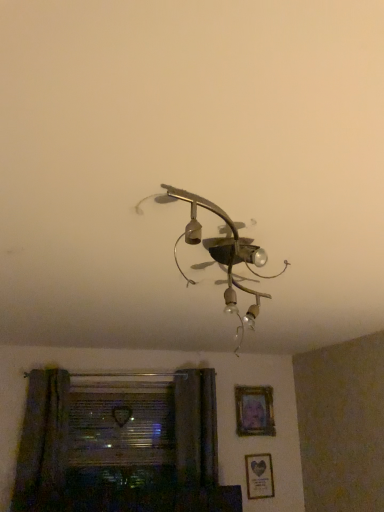
What do you see at coordinates (219, 252) in the screenshot? This screenshot has width=384, height=512. I see `metallic chandelier at center` at bounding box center [219, 252].

This screenshot has height=512, width=384. What do you see at coordinates (254, 411) in the screenshot?
I see `wooden frame at upper center, positioned as the 1th picture frame in top-to-bottom order` at bounding box center [254, 411].

Locate an element on the screen. The width and height of the screenshot is (384, 512). green fabric curtain at lower left is located at coordinates (43, 442).

Find the location of a particular element. This screenshot has width=384, height=512. matte gold picture frame at lower right, positioned as the 2th picture frame in top-to-bottom order is located at coordinates (259, 476).

Locate an element on the screen. This screenshot has width=384, height=512. transparent glass window at lower left is located at coordinates (121, 426).

Would you say matte gold picture frame at lower right, positioned as the 2th picture frame in top-to-bottom order, is outside metallic chandelier at center?

Absolutely, matte gold picture frame at lower right, positioned as the 2th picture frame in top-to-bottom order, is external to metallic chandelier at center.

Is matte gold picture frame at lower right, the first picture frame when ordered from bottom to top, facing towards metallic chandelier at center?

No, matte gold picture frame at lower right, the first picture frame when ordered from bottom to top, is not facing towards metallic chandelier at center.

Consider the image. Are matte gold picture frame at lower right, positioned as the 2th picture frame in top-to-bottom order, and metallic chandelier at center beside each other?

No, matte gold picture frame at lower right, positioned as the 2th picture frame in top-to-bottom order, is not beside metallic chandelier at center.

Is matte gold picture frame at lower right, the first picture frame when ordered from bottom to top, closer to camera compared to metallic chandelier at center?

No, matte gold picture frame at lower right, the first picture frame when ordered from bottom to top, is further to the viewer.

Considering the relative sizes of green fabric curtain at lower left and wooden frame at upper center, the second picture frame positioned from the bottom, in the image provided, is green fabric curtain at lower left bigger than wooden frame at upper center, the second picture frame positioned from the bottom,?

Yes, green fabric curtain at lower left is bigger than wooden frame at upper center, the second picture frame positioned from the bottom.

Is green fabric curtain at lower left next to wooden frame at upper center, the second picture frame positioned from the bottom, and touching it?

green fabric curtain at lower left and wooden frame at upper center, the second picture frame positioned from the bottom, are not in contact.

In the scene shown: Is green fabric curtain at lower left inside or outside of wooden frame at upper center, the second picture frame positioned from the bottom?

green fabric curtain at lower left lies outside wooden frame at upper center, the second picture frame positioned from the bottom.

Which is closer to the camera, [141,415] or [247,409]?

Point [141,415]

Is transparent glass window at lower left positioned with its back to wooden frame at upper center, positioned as the 1th picture frame in top-to-bottom order?

No, transparent glass window at lower left is not facing away from wooden frame at upper center, positioned as the 1th picture frame in top-to-bottom order.

In the scene shown: Considering the positions of objects transparent glass window at lower left and wooden frame at upper center, positioned as the 1th picture frame in top-to-bottom order, in the image provided, who is behind, transparent glass window at lower left or wooden frame at upper center, positioned as the 1th picture frame in top-to-bottom order,?

wooden frame at upper center, positioned as the 1th picture frame in top-to-bottom order, is more distant.

From the image's perspective, is transparent glass window at lower left located above or below wooden frame at upper center, positioned as the 1th picture frame in top-to-bottom order?

Based on their image positions, transparent glass window at lower left is located beneath wooden frame at upper center, positioned as the 1th picture frame in top-to-bottom order.

Which of these two, metallic chandelier at center or matte gold picture frame at lower right, positioned as the 2th picture frame in top-to-bottom order, is wider?

metallic chandelier at center.

From a real-world perspective, which object stands above the other?

In real-world perspective, metallic chandelier at center is above.

Which point is more forward, (219,259) or (250,476)?

The point (219,259) is closer to the camera.

Locate an element on the screen. curtain on the left of transparent glass window at lower left is located at coordinates (43, 442).

Does green fabric curtain at lower left have a smaller size compared to transparent glass window at lower left?

No.

From the image's perspective, between green fabric curtain at lower left and transparent glass window at lower left, who is located below?

transparent glass window at lower left is shown below in the image.

Based on the photo, considering their positions, is green fabric curtain at lower left located in front of or behind transparent glass window at lower left?

green fabric curtain at lower left is positioned closer to the viewer than transparent glass window at lower left.

Considering the points (239, 395) and (96, 423), which point is in front, point (239, 395) or point (96, 423)?

Point (96, 423)

How much distance is there between wooden frame at upper center, the second picture frame positioned from the bottom, and transparent glass window at lower left?

They are 32.63 inches apart.

Which is more to the left, wooden frame at upper center, the second picture frame positioned from the bottom, or transparent glass window at lower left?

transparent glass window at lower left.

Which is in front, point (246, 259) or point (258, 396)?

Positioned in front is point (246, 259).

From the image's perspective, which one is positioned higher, metallic chandelier at center or wooden frame at upper center, the second picture frame positioned from the bottom?

From the image's view, metallic chandelier at center is above.

Are metallic chandelier at center and wooden frame at upper center, the second picture frame positioned from the bottom, making contact?

There is a gap between metallic chandelier at center and wooden frame at upper center, the second picture frame positioned from the bottom.

From a real-world perspective, is metallic chandelier at center on top of wooden frame at upper center, the second picture frame positioned from the bottom?

Correct, in the physical world, metallic chandelier at center is higher than wooden frame at upper center, the second picture frame positioned from the bottom.

Image resolution: width=384 pixels, height=512 pixels. Find the location of `lamp on the left of matte gold picture frame at lower right, the first picture frame when ordered from bottom to top`. lamp on the left of matte gold picture frame at lower right, the first picture frame when ordered from bottom to top is located at coordinates (219, 252).

Locate an element on the screen. This screenshot has width=384, height=512. curtain lying in front of the wooden frame at upper center, positioned as the 1th picture frame in top-to-bottom order is located at coordinates (43, 442).

Based on their spatial positions, is transparent glass window at lower left or green fabric curtain at lower left closer to metallic chandelier at center?

green fabric curtain at lower left is closer to metallic chandelier at center.

Looking at the image, which one is located further to wooden frame at upper center, positioned as the 1th picture frame in top-to-bottom order, metallic chandelier at center or matte gold picture frame at lower right, the first picture frame when ordered from bottom to top?

The object further to wooden frame at upper center, positioned as the 1th picture frame in top-to-bottom order, is metallic chandelier at center.

Considering their positions, is wooden frame at upper center, the second picture frame positioned from the bottom, positioned further to transparent glass window at lower left than metallic chandelier at center?

metallic chandelier at center.

In the scene shown: Based on their spatial positions, is green fabric curtain at lower left or metallic chandelier at center further from wooden frame at upper center, positioned as the 1th picture frame in top-to-bottom order?

metallic chandelier at center is further to wooden frame at upper center, positioned as the 1th picture frame in top-to-bottom order.

Which object lies further to the anchor point wooden frame at upper center, positioned as the 1th picture frame in top-to-bottom order, matte gold picture frame at lower right, positioned as the 2th picture frame in top-to-bottom order, or green fabric curtain at lower left?

green fabric curtain at lower left.

From the image, which object appears to be farther from transparent glass window at lower left, matte gold picture frame at lower right, positioned as the 2th picture frame in top-to-bottom order, or green fabric curtain at lower left?

matte gold picture frame at lower right, positioned as the 2th picture frame in top-to-bottom order, is further to transparent glass window at lower left.

Considering their positions, is green fabric curtain at lower left positioned closer to transparent glass window at lower left than metallic chandelier at center?

green fabric curtain at lower left is closer to transparent glass window at lower left.

Considering their positions, is green fabric curtain at lower left positioned further to matte gold picture frame at lower right, the first picture frame when ordered from bottom to top, than transparent glass window at lower left?

green fabric curtain at lower left is further to matte gold picture frame at lower right, the first picture frame when ordered from bottom to top.

Where is `curtain between metallic chandelier at center and transparent glass window at lower left in the front-back direction`? This screenshot has width=384, height=512. curtain between metallic chandelier at center and transparent glass window at lower left in the front-back direction is located at coordinates (43, 442).

I want to click on picture frame between green fabric curtain at lower left and matte gold picture frame at lower right, the first picture frame when ordered from bottom to top, from left to right, so click(254, 411).

The width and height of the screenshot is (384, 512). What are the coordinates of `curtain located between metallic chandelier at center and matte gold picture frame at lower right, the first picture frame when ordered from bottom to top, in the depth direction` in the screenshot? It's located at coord(43,442).

The width and height of the screenshot is (384, 512). In order to click on picture frame between metallic chandelier at center and wooden frame at upper center, the second picture frame positioned from the bottom, from front to back in this screenshot , I will do `click(259, 476)`.